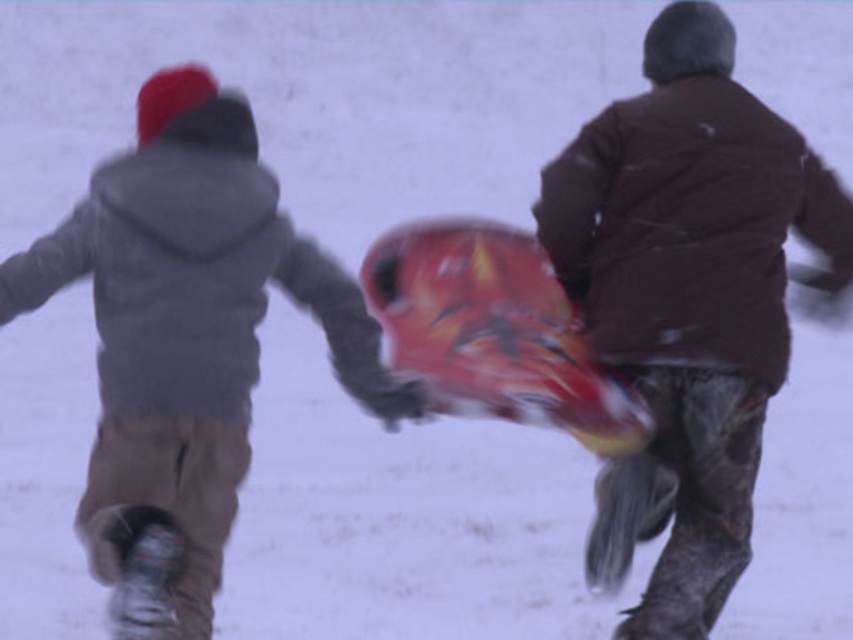
Can you confirm if brown matte jacket at center is thinner than matte gray hoodie at left?

Yes, brown matte jacket at center is thinner than matte gray hoodie at left.

Between brown matte jacket at center and matte gray hoodie at left, which one appears on the left side from the viewer's perspective?

Positioned to the left is matte gray hoodie at left.

In the scene shown: Measure the distance between brown matte jacket at center and camera.

17.25 feet

What are the coordinates of `brown matte jacket at center` in the screenshot? It's located at (688, 300).

Is brown matte jacket at center smaller than shiny plastic snowboard at center?

Actually, brown matte jacket at center might be larger than shiny plastic snowboard at center.

Locate an element on the screen. The height and width of the screenshot is (640, 853). brown matte jacket at center is located at coordinates (688, 300).

Identify the location of brown matte jacket at center. This screenshot has width=853, height=640. (688, 300).

From the picture: Who is lower down, matte gray hoodie at left or shiny plastic snowboard at center?

Positioned lower is matte gray hoodie at left.

Measure the distance between point (329,300) and camera.

The distance of point (329,300) from camera is 5.34 meters.

Does point (100, 420) lie in front of point (573, 381)?

That is False.

Where is `matte gray hoodie at left`? matte gray hoodie at left is located at coordinates (184, 340).